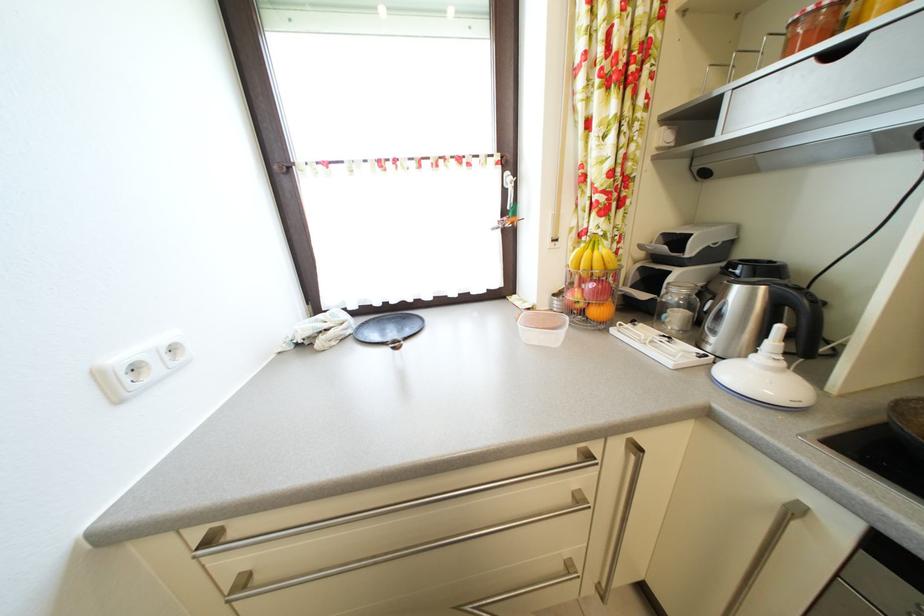
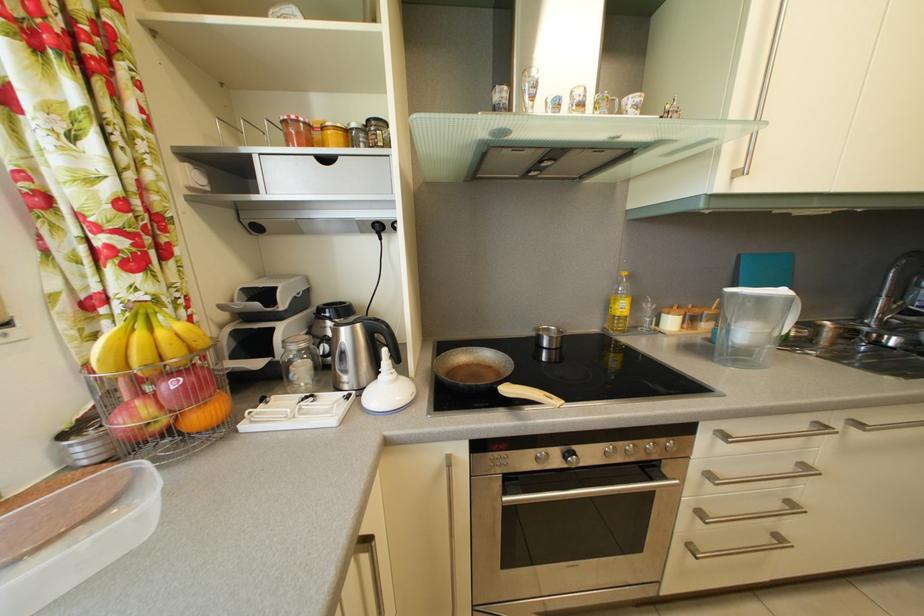
Question: The camera is either moving clockwise (left) or counter-clockwise (right) around the object. The first image is from the beginning of the video and the second image is from the end. Is the camera moving left or right when shooting the video?

Choices:
 (A) Left
 (B) Right

Answer: (A)